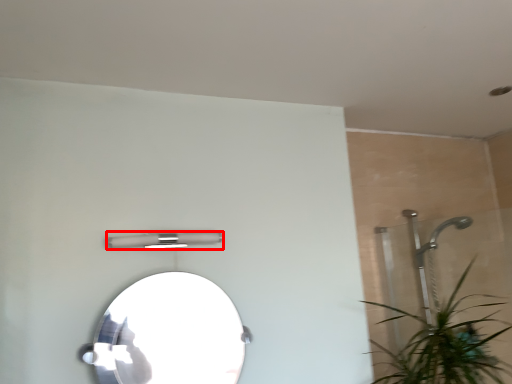
Question: Observing the image, what is the correct spatial positioning of light fixture (annotated by the red box) in reference to mirror?

Choices:
 (A) left
 (B) right

Answer: (A)